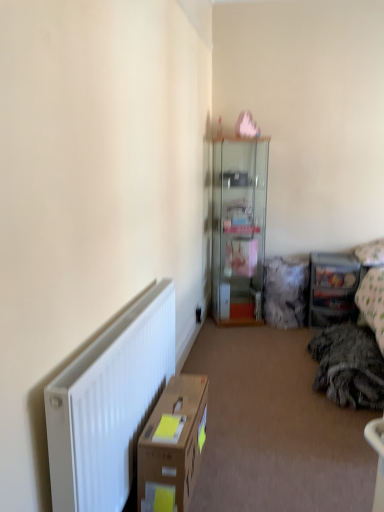
What is the approximate width of white matte radiator at lower left?

white matte radiator at lower left is 1.27 inches wide.

Where is `brown cardboard box at lower left`? brown cardboard box at lower left is located at coordinates (173, 445).

Measure the distance between brown cardboard box at lower left and camera.

The depth of brown cardboard box at lower left is 5.38 feet.

The width and height of the screenshot is (384, 512). Describe the element at coordinates (371, 253) in the screenshot. I see `fluffy white pillow at upper right` at that location.

This screenshot has height=512, width=384. Identify the location of fluffy white pillow at upper right. (371, 253).

This screenshot has width=384, height=512. What are the coordinates of `white matte radiator at lower left` in the screenshot? It's located at (109, 405).

In the image, there is a fluffy white pillow at upper right. Find the location of `shelf below it (from the image's perspective)`. shelf below it (from the image's perspective) is located at coordinates (332, 288).

Could you tell me if clear plastic storage at right is facing fluffy white pillow at upper right?

No, clear plastic storage at right does not turn towards fluffy white pillow at upper right.

From a real-world perspective, is clear plastic storage at right positioned over fluffy white pillow at upper right based on gravity?

No, from a real-world perspective, clear plastic storage at right is not above fluffy white pillow at upper right.

Locate an element on the screen. This screenshot has height=512, width=384. cabinetry that is on the right side of white matte radiator at lower left is located at coordinates (239, 228).

Which point is more forward, (x=247, y=310) or (x=141, y=376)?

The point (x=141, y=376) is in front.

Is transparent glass cabinet at upper center thinner than white matte radiator at lower left?

No.

From a real-world perspective, is clear plastic storage at right located beneath brown cardboard box at lower left?

Actually, clear plastic storage at right is physically above brown cardboard box at lower left in the real world.

Between clear plastic storage at right and brown cardboard box at lower left, which one appears on the left side from the viewer's perspective?

brown cardboard box at lower left.

Which object is more forward, clear plastic storage at right or brown cardboard box at lower left?

Positioned in front is brown cardboard box at lower left.

Could you tell me if clear plastic storage at right is facing brown cardboard box at lower left?

No.

Would you say transparent glass cabinet at upper center is outside fluffy white pillow at upper right?

transparent glass cabinet at upper center is positioned outside fluffy white pillow at upper right.

Is transparent glass cabinet at upper center behind fluffy white pillow at upper right?

Yes, it is.

Locate an element on the screen. The height and width of the screenshot is (512, 384). pillow below the transparent glass cabinet at upper center (from the image's perspective) is located at coordinates (371, 253).

From a real-world perspective, which object rests below the other?

fluffy white pillow at upper right is physically lower.

Are fluffy white pillow at upper right and brown cardboard box at lower left making contact?

There is a gap between fluffy white pillow at upper right and brown cardboard box at lower left.

From the picture: From the image's perspective, is fluffy white pillow at upper right on brown cardboard box at lower left?

Yes, from the image's perspective, fluffy white pillow at upper right is above brown cardboard box at lower left.

Is fluffy white pillow at upper right oriented towards brown cardboard box at lower left?

No.

In terms of height, does brown cardboard box at lower left look taller or shorter compared to transparent glass cabinet at upper center?

In the image, brown cardboard box at lower left appears to be shorter than transparent glass cabinet at upper center.

From the picture: Considering the positions of objects brown cardboard box at lower left and transparent glass cabinet at upper center in the image provided, who is in front, brown cardboard box at lower left or transparent glass cabinet at upper center?

brown cardboard box at lower left.

From the image's perspective, which is above, brown cardboard box at lower left or transparent glass cabinet at upper center?

transparent glass cabinet at upper center.

Considering the relative positions of brown cardboard box at lower left and transparent glass cabinet at upper center in the image provided, is brown cardboard box at lower left to the left or to the right of transparent glass cabinet at upper center?

Clearly, brown cardboard box at lower left is on the left of transparent glass cabinet at upper center in the image.

Which of these two, brown cardboard box at lower left or clear plastic storage at right, is smaller?

brown cardboard box at lower left is smaller.

From the image's perspective, between brown cardboard box at lower left and clear plastic storage at right, who is located below?

brown cardboard box at lower left.

Considering the sizes of brown cardboard box at lower left and clear plastic storage at right in the image, is brown cardboard box at lower left taller or shorter than clear plastic storage at right?

In the image, brown cardboard box at lower left appears to be shorter than clear plastic storage at right.

Identify the location of shelf that appears below the fluffy white pillow at upper right (from the image's perspective). (332, 288).

This screenshot has height=512, width=384. In order to click on radiator below the transparent glass cabinet at upper center (from a real-world perspective) in this screenshot , I will do `click(109, 405)`.

When comparing their distances from brown cardboard box at lower left, does clear plastic storage at right or white matte radiator at lower left seem closer?

Among the two, white matte radiator at lower left is located nearer to brown cardboard box at lower left.

Estimate the real-world distances between objects in this image. Which object is further from transparent glass cabinet at upper center, clear plastic storage at right or white matte radiator at lower left?

Among the two, white matte radiator at lower left is located further to transparent glass cabinet at upper center.

Which object lies further to the anchor point white matte radiator at lower left, fluffy white pillow at upper right or brown cardboard box at lower left?

Based on the image, fluffy white pillow at upper right appears to be further to white matte radiator at lower left.

Which object lies further to the anchor point white matte radiator at lower left, transparent glass cabinet at upper center or brown cardboard box at lower left?

Among the two, transparent glass cabinet at upper center is located further to white matte radiator at lower left.

Considering their positions, is brown cardboard box at lower left positioned closer to clear plastic storage at right than fluffy white pillow at upper right?

The object closer to clear plastic storage at right is fluffy white pillow at upper right.

Looking at the image, which one is located further to clear plastic storage at right, brown cardboard box at lower left or white matte radiator at lower left?

white matte radiator at lower left is further to clear plastic storage at right.

Looking at the image, which one is located further to white matte radiator at lower left, transparent glass cabinet at upper center or clear plastic storage at right?

clear plastic storage at right lies further to white matte radiator at lower left than the other object.

Considering their positions, is brown cardboard box at lower left positioned closer to transparent glass cabinet at upper center than fluffy white pillow at upper right?

fluffy white pillow at upper right lies closer to transparent glass cabinet at upper center than the other object.

Find the location of `pillow located between white matte radiator at lower left and clear plastic storage at right in the depth direction`. pillow located between white matte radiator at lower left and clear plastic storage at right in the depth direction is located at coordinates (371, 253).

Locate an element on the screen. The image size is (384, 512). pillow between brown cardboard box at lower left and clear plastic storage at right from front to back is located at coordinates (371, 253).

The width and height of the screenshot is (384, 512). I want to click on cabinetry located between white matte radiator at lower left and clear plastic storage at right in the depth direction, so click(x=239, y=228).

Where is `cardboard box between white matte radiator at lower left and clear plastic storage at right from front to back`? The image size is (384, 512). cardboard box between white matte radiator at lower left and clear plastic storage at right from front to back is located at coordinates (173, 445).